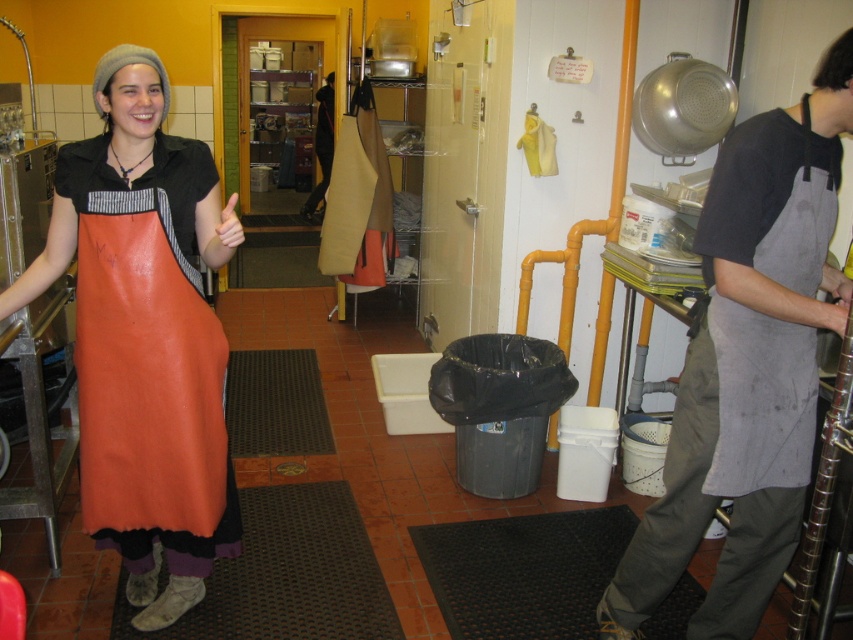
Question: Estimate the real-world distances between objects in this image. Which object is closer to the skinny white hand at center?

Choices:
 (A) orange leather apron at left
 (B) gray fabric apron at right
 (C) gray apron at right

Answer: (A)

Question: Among these points, which one is nearest to the camera?

Choices:
 (A) [132, 344]
 (B) [838, 132]

Answer: (B)

Question: Can you confirm if orange leather apron at left is positioned above gray fabric apron at right?

Choices:
 (A) yes
 (B) no

Answer: (B)

Question: Is orange leather apron at left positioned behind skinny white hand at center?

Choices:
 (A) yes
 (B) no

Answer: (A)

Question: Does orange leather apron at left have a lesser width compared to gray fabric apron at right?

Choices:
 (A) no
 (B) yes

Answer: (A)

Question: Estimate the real-world distances between objects in this image. Which object is farther from the gray fabric apron at right?

Choices:
 (A) orange leather apron at left
 (B) gray apron at right

Answer: (A)